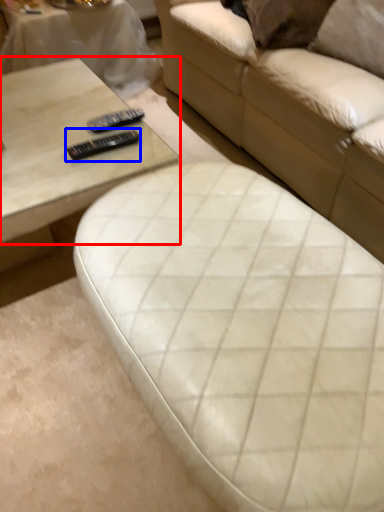
Question: Which of the following is the closest to the observer, coffee table (highlighted by a red box) or remote (highlighted by a blue box)?

Choices:
 (A) coffee table
 (B) remote

Answer: (A)